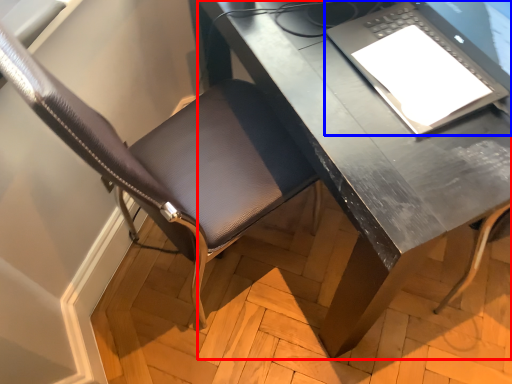
Question: Among these objects, which one is nearest to the camera, desk (highlighted by a red box) or laptop (highlighted by a blue box)?

Choices:
 (A) desk
 (B) laptop

Answer: (B)